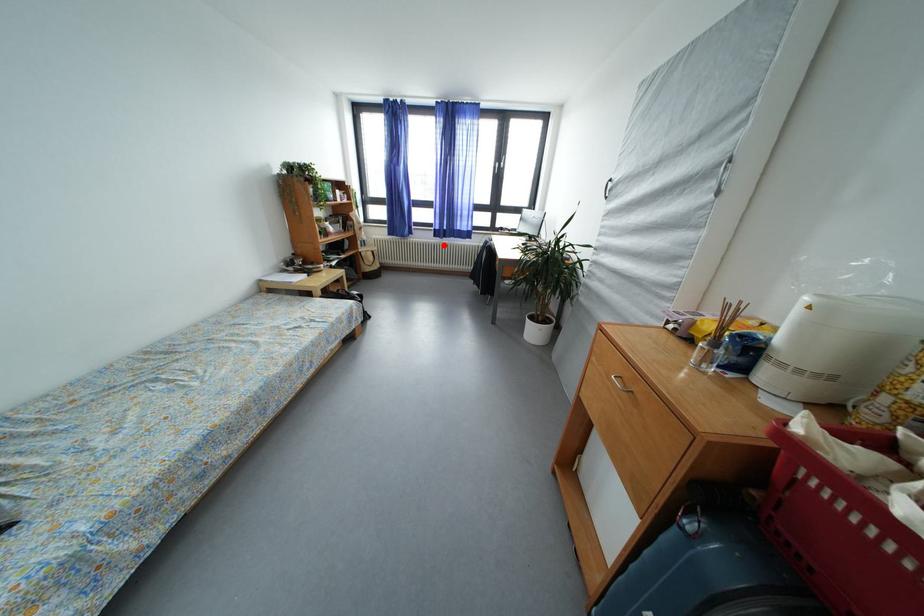
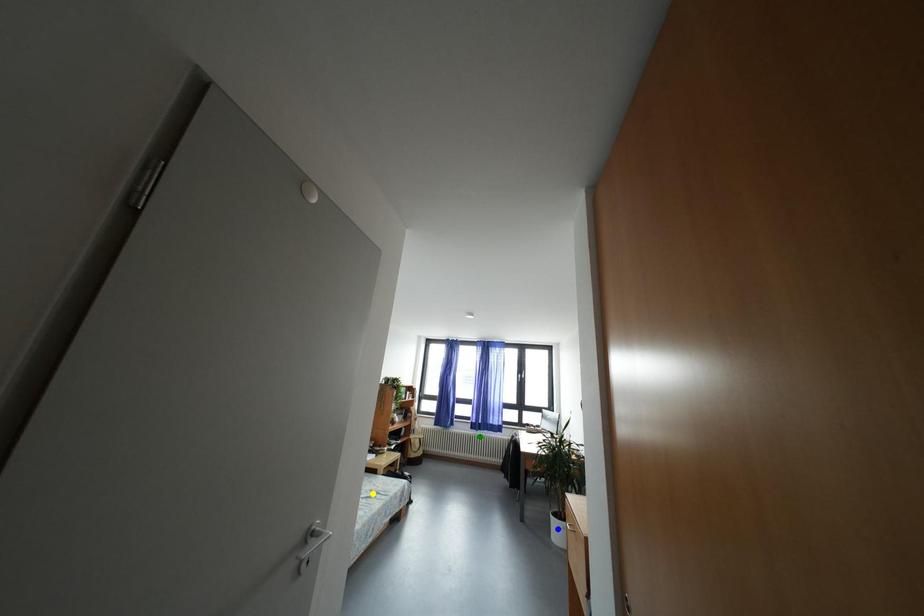
Question: I am providing you with two images of the same scene from different viewpoints. A red point is marked on the first image. You are given multiple points on the second image. Which mark in image 2 goes with the point in image 1?

Choices:
 (A) blue point
 (B) green point
 (C) yellow point

Answer: (B)